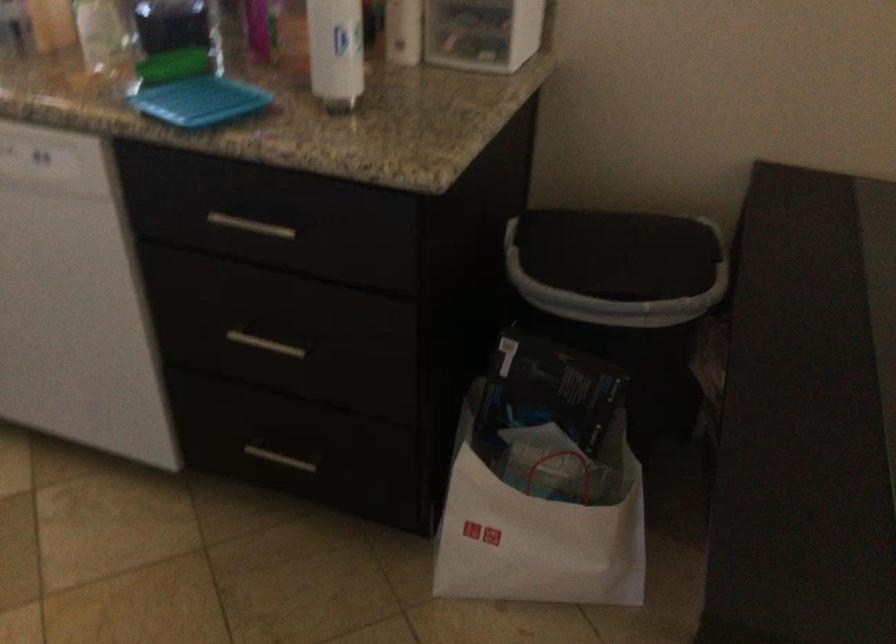
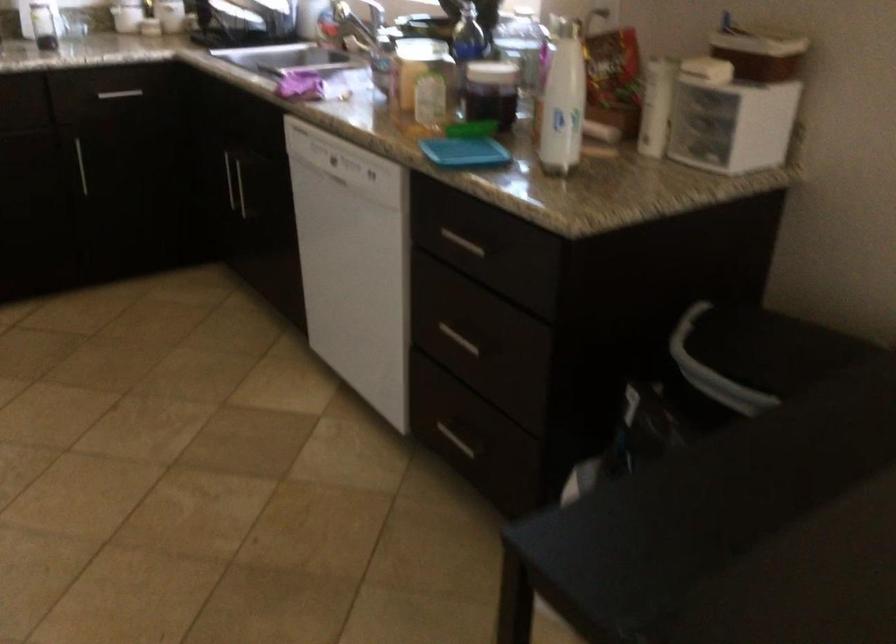
Locate, in the second image, the point that corresponds to the point at 253,343 in the first image.

(459, 339)